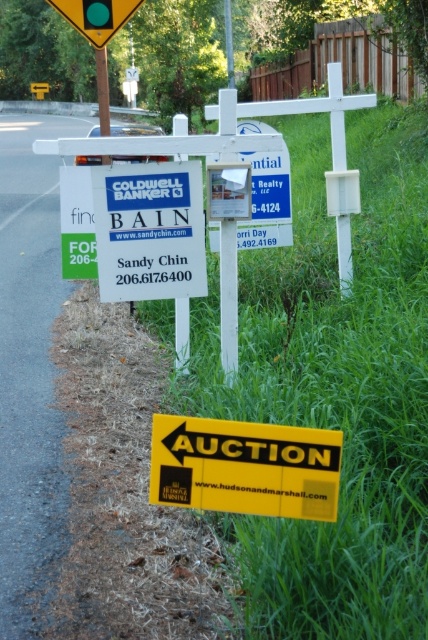
Question: Which of the following is the closest to the observer?

Choices:
 (A) (247, 452)
 (B) (100, 28)
 (C) (140, 307)

Answer: (A)

Question: Among these objects, which one is farthest from the camera?

Choices:
 (A) yellow matte auction sign at lower center
 (B) green grass at lower right

Answer: (A)

Question: Can you confirm if green grass at lower right is positioned above yellow matte auction sign at lower center?

Choices:
 (A) no
 (B) yes

Answer: (B)

Question: Among these points, which one is farthest from the camera?

Choices:
 (A) (160, 321)
 (B) (269, 454)

Answer: (A)

Question: In this image, where is green grass at lower right located relative to yellow matte auction sign at lower center?

Choices:
 (A) right
 (B) left

Answer: (A)

Question: Is green grass at lower right to the left of metallic yellow triangle at upper center from the viewer's perspective?

Choices:
 (A) yes
 (B) no

Answer: (B)